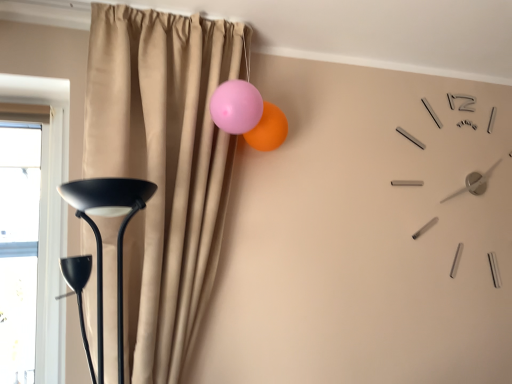
Question: Considering the positions of pink glossy balloon at upper center and transparent glass window at left in the image, is pink glossy balloon at upper center wider or thinner than transparent glass window at left?

Choices:
 (A) wide
 (B) thin

Answer: (A)

Question: Considering the positions of pink glossy balloon at upper center and transparent glass window at left in the image, is pink glossy balloon at upper center bigger or smaller than transparent glass window at left?

Choices:
 (A) big
 (B) small

Answer: (B)

Question: Which is nearer to the beige curtain at upper center?

Choices:
 (A) pink glossy balloon at upper center
 (B) transparent glass window at left

Answer: (A)

Question: Based on their relative distances, which object is farther from the pink glossy balloon at upper center?

Choices:
 (A) beige curtain at upper center
 (B) transparent glass window at left

Answer: (B)